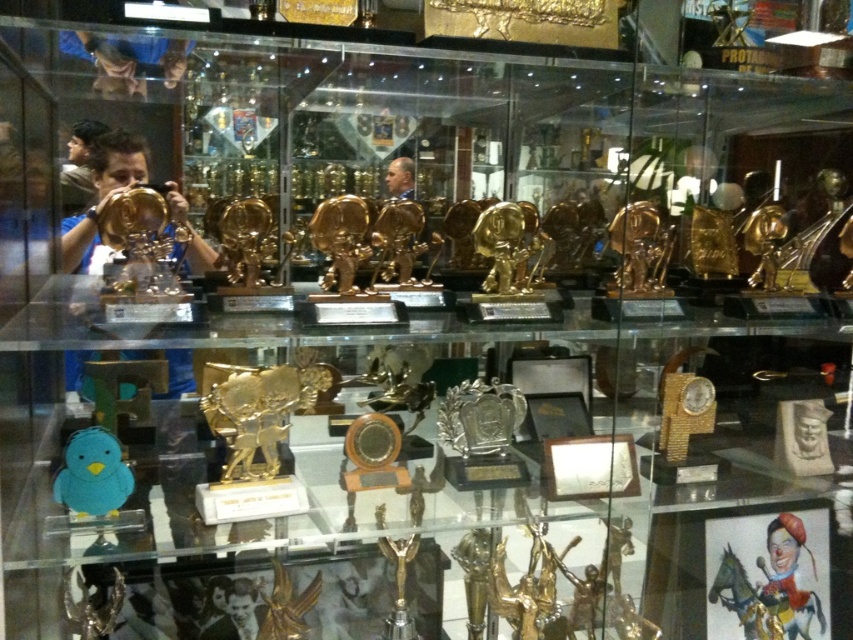
Does matte gold trophy at left come in front of smooth gold statue at center?

Yes, it is in front of smooth gold statue at center.

Between point (61, 230) and point (397, 157), which one is positioned behind?

The point (397, 157) is behind.

Between point (134, 154) and point (410, 180), which one is positioned in front?

Positioned in front is point (134, 154).

Identify the location of matte gold trophy at left. (102, 193).